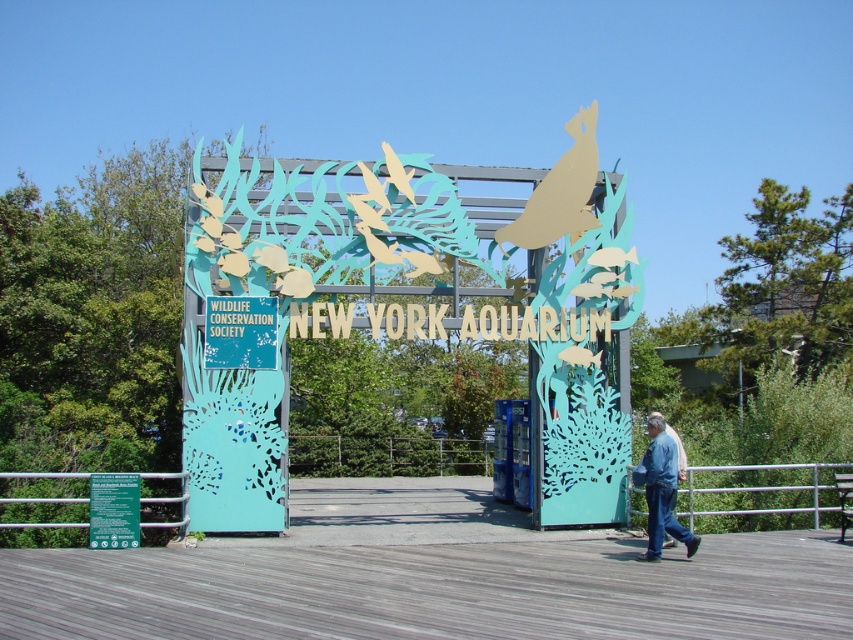
You are standing at the entrance of the New York Aquarium and want to take a photo of both the large stylized sign and the smaller sign to the left. Which point, point 1 at coordinates (260,432) or point 2 at coordinates (693,540), is closer to you as you face the entrance?

Point 1 at coordinates (260,432) is closer to you because it is further to the viewer than point 2 at coordinates (693,540).

You are standing at the entrance of the New York Aquarium and see the metallic blue sign at center and the blue paper sign at center. Which one is positioned higher?

Answer: The metallic blue sign at center is located above the blue paper sign at center, so it is positioned higher.

You are standing at the entrance of the New York Aquarium and see the metallic blue sign at center and the blue jeans at lower right. Which object is narrower?

The metallic blue sign at center is thinner than blue jeans at lower right, so the metallic blue sign at center is narrower.